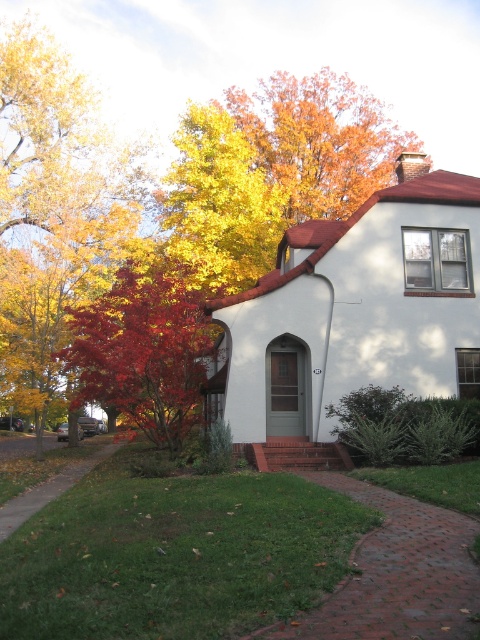
You are a gardener planning to install a new sprinkler system between the orange leafy tree at upper center and the golden leafy tree at upper center. The sprinkler system requires a minimum of 20 feet of space to function properly. Based on the image, will the available space between these two trees be sufficient for the sprinkler system?

The distance between the orange leafy tree at upper center and the golden leafy tree at upper center is 21.67 feet, which exceeds the minimum requirement of 20 feet. Therefore, the available space is sufficient for the sprinkler system.

You are a delivery person approaching the house and need to determine the best path to the front door. Considering the shiny red maple tree at left and the orange leafy tree at upper center, which tree should you use as a landmark to ensure you are heading toward the house?

The shiny red maple tree at left is in front of the orange leafy tree at upper center, so you should use the shiny red maple tree at left as your landmark since it is closer to the house and directly in the path leading towards it.

You are standing at the front door of the suburban house and want to plant a new flower bed. The orange leafy tree at upper center is at point (x=320, y=140). Where should you place the flower bed so it is directly in front of the house but not under the tree?

The orange leafy tree at upper center is located at point (x=320, y=140). To place the flower bed directly in front of the house without being under the tree, choose a spot along the brick pathway or the lawn area near the front entrance, avoiding the coordinates of the tree.